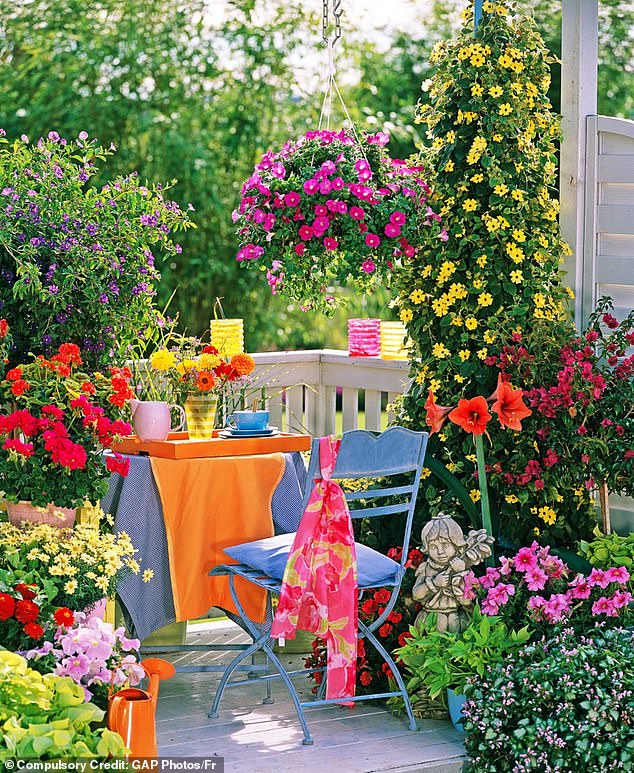
This screenshot has width=634, height=773. Find the location of `statue`. statue is located at coordinates pos(444,573).